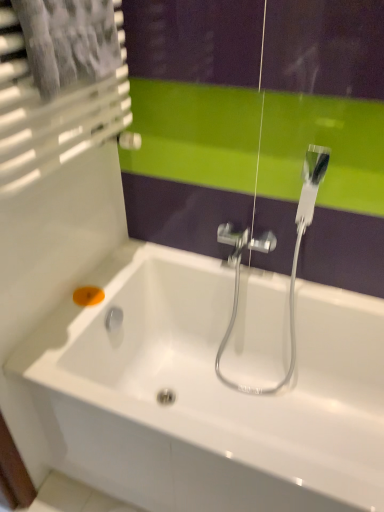
Locate an element on the screen. The width and height of the screenshot is (384, 512). vacant space in front of orange matte soap at lower left is located at coordinates (70, 325).